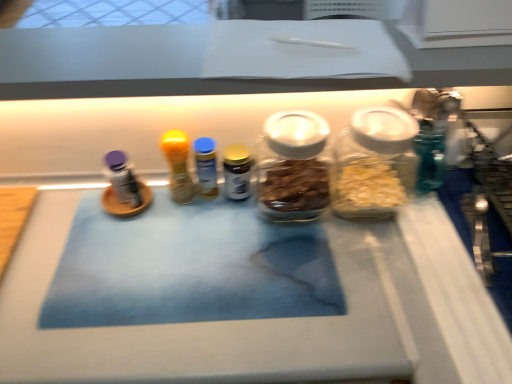
Locate an element on the screen. This screenshot has height=384, width=512. vacant area that is in front of blue plastic bottle at center, the second bottle viewed from the left is located at coordinates (202, 262).